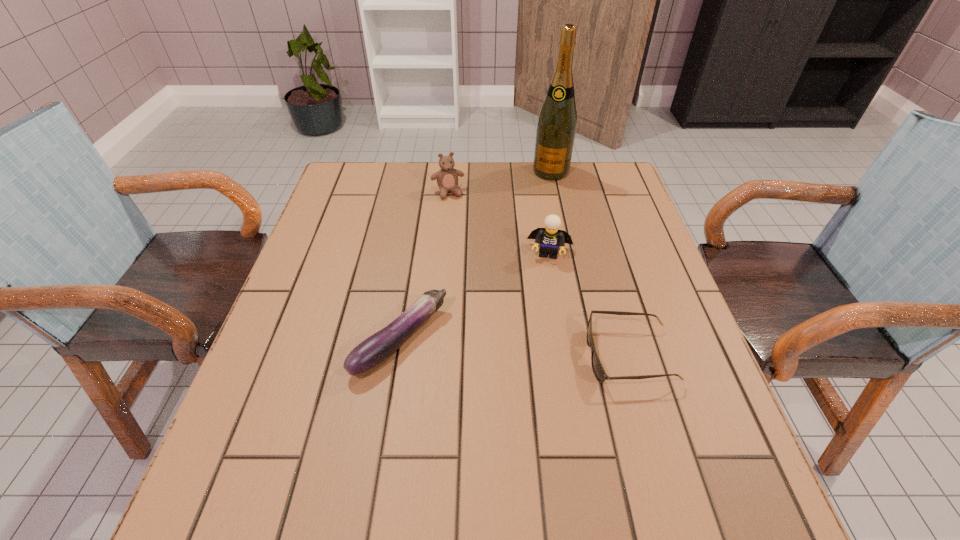
The width and height of the screenshot is (960, 540). Identify the location of eggplant. (375, 349).

You are a GUI agent. You are given a task and a screenshot of the screen. Output one action in this format:
    pyautogui.click(x=<x>, y=<y>)
    Task: Click on the shortest object
    This screenshot has width=960, height=540.
    Given the screenshot: What is the action you would take?
    pyautogui.click(x=598, y=370)

At what (x,y) coordinates should I click in order to perform the action: click on the fourth nearest object. Please return your answer as a coordinate pair (x, y). Looking at the image, I should click on click(x=447, y=177).

Find the location of `the tallest object`. the tallest object is located at coordinates (556, 127).

Image resolution: width=960 pixels, height=540 pixels. I want to click on wine bottle, so click(x=556, y=127).

The height and width of the screenshot is (540, 960). Identify the location of the third farthest object. (550, 237).

At what (x,y) coordinates should I click in order to perform the action: click on free spot located on the back of the eggplant. Please return your answer as a coordinate pair (x, y). The height and width of the screenshot is (540, 960). Looking at the image, I should click on (419, 225).

Image resolution: width=960 pixels, height=540 pixels. In order to click on vacant space positioned on the lenses of the sunglasses in this screenshot , I will do point(559,356).

Find the location of a particular element. This screenshot has width=960, height=540. vacant area located 0.220m on the lenses of the sunglasses is located at coordinates (480, 356).

Identify the location of vacant space located on the lenses of the sunglasses. This screenshot has height=540, width=960. (470, 356).